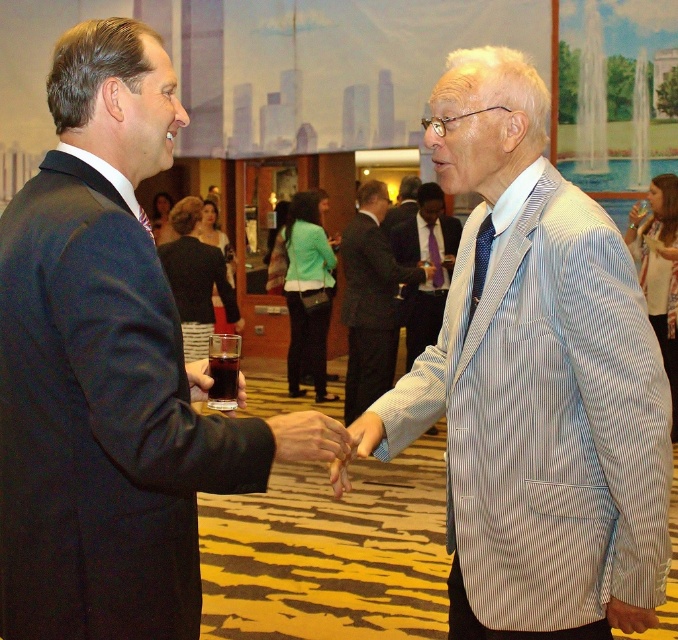
You are a photographer at the event and need to capture a photo of both the light blue striped blazer at right and the light blue striped blazer at center. Which blazer should you focus on first to ensure it appears larger in the photo?

The light blue striped blazer at center should be focused on first because it is taller than the light blue striped blazer at right, so it will naturally appear larger in the photo.

You are a tailor who needs to know which blazer requires more fabric. Based on the image, which blazer is wider, the light blue striped blazer at right or the striped cotton blazer at center?

The light blue striped blazer at right is wider than the striped cotton blazer at center, so it requires more fabric.

You are a photographer at the event and want to capture both the light blue striped blazer at right and the light blue striped blazer at center in a single photo. Based on their positions, which one is closer to the bottom of the frame?

The light blue striped blazer at right is closer to the bottom of the frame because it is positioned below the light blue striped blazer at center.